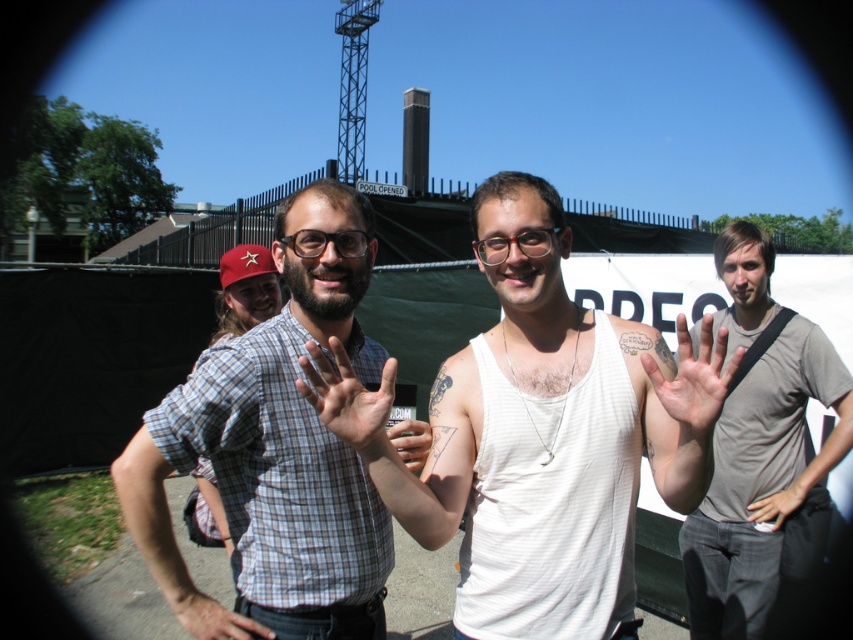
Does point (234, 496) come closer to viewer compared to point (383, 403)?

No, (234, 496) is behind (383, 403).

Is checkered fabric shirt at center smaller than light skin flesh at center?

Incorrect, checkered fabric shirt at center is not smaller in size than light skin flesh at center.

Is point (322, 221) closer to viewer compared to point (384, 369)?

No, it is not.

You are a GUI agent. You are given a task and a screenshot of the screen. Output one action in this format:
    pyautogui.click(x=<x>, y=<y>)
    Task: Click on the checkered fabric shirt at center
    The height and width of the screenshot is (640, 853).
    Given the screenshot: What is the action you would take?
    pyautogui.click(x=277, y=449)

Does checkered fabric shirt at center appear on the left side of light skin hand at center?

Indeed, checkered fabric shirt at center is positioned on the left side of light skin hand at center.

Between checkered fabric shirt at center and light skin hand at center, which one appears on the left side from the viewer's perspective?

checkered fabric shirt at center is more to the left.

Does point (212, 390) lie behind point (692, 349)?

No, it is in front of (692, 349).

Locate an element on the screen. checkered fabric shirt at center is located at coordinates (277, 449).

Between translucent orange glasses at center and white matte hand at center, which one has more height?

Standing taller between the two is white matte hand at center.

Looking at this image, who is positioned more to the right, translucent orange glasses at center or white matte hand at center?

white matte hand at center

The image size is (853, 640). Describe the element at coordinates (515, 244) in the screenshot. I see `translucent orange glasses at center` at that location.

Locate an element on the screen. translucent orange glasses at center is located at coordinates (515, 244).